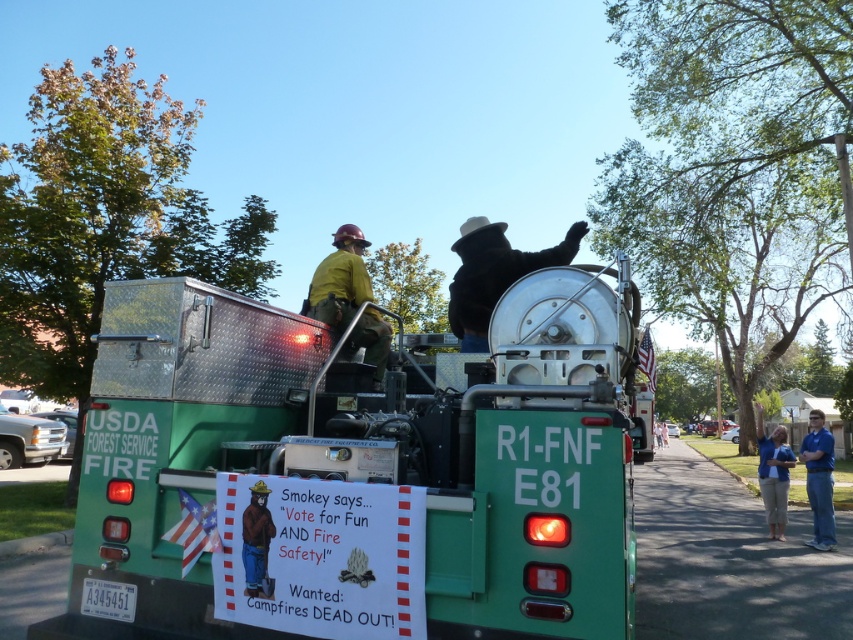
Question: Can you confirm if blue shirt at right is wider than white plastic license plate at lower left?

Choices:
 (A) yes
 (B) no

Answer: (A)

Question: Which point appears closest to the camera in this image?

Choices:
 (A) (334, 314)
 (B) (780, 532)
 (C) (259, 513)
 (D) (84, 604)

Answer: (C)

Question: Which of the following is the closest to the observer?

Choices:
 (A) (259, 548)
 (B) (305, 472)
 (C) (762, 490)
 (D) (355, 244)

Answer: (A)

Question: Among these objects, which one is farthest from the camera?

Choices:
 (A) blue fabric shirt at lower right
 (B) green aluminum fire truck at center

Answer: (A)

Question: Does green aluminum fire truck at center have a smaller size compared to yellow hard hat at center?

Choices:
 (A) no
 (B) yes

Answer: (A)

Question: Where is green aluminum fire truck at center located in relation to blue shirt at right in the image?

Choices:
 (A) below
 (B) above

Answer: (B)